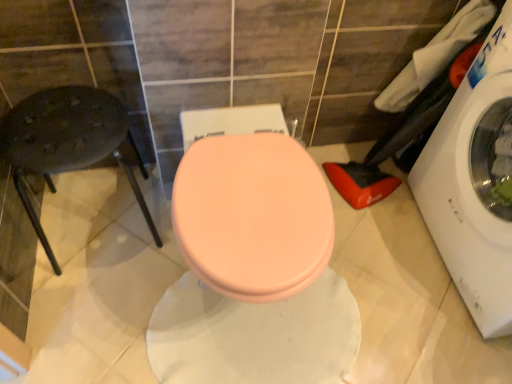
I want to click on vacant point above matte pink toilet seat at center (from a real-world perspective), so click(251, 201).